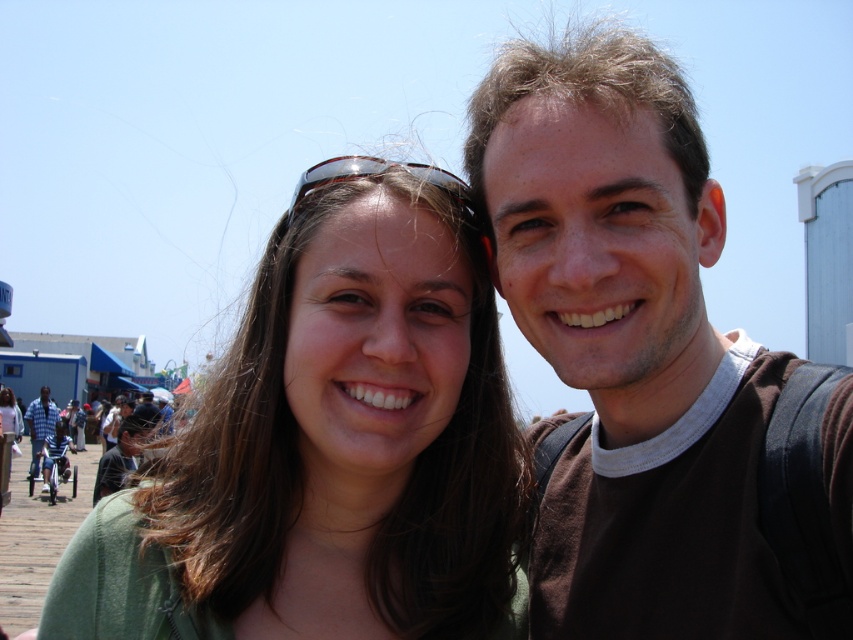
Based on the photo, you are a photographer trying to capture a closeup shot of the sunglasses at center and the green matte hair at center. Which object should you focus on first if you want to ensure both are in focus?

The green matte hair at center is positioned on the right side of sunglasses at center. Since they are both at the same distance from the camera, focusing on either one will keep both in focus.

You are standing at the edge of a boardwalk and see the person with green matte hair at center in the distance. If you want to take a closer photo of them without moving, which direction should you zoom your camera lens?

The green matte hair at center is 14.09 meters away from the viewer. To take a closer photo without moving, you should zoom your camera lens forward to focus on the green matte hair at center.

You are standing in front of the image and want to determine which of the two points, point (231, 612) or point (463, 186), is nearer to you. Based on the scene, which point is closer?

Point (231, 612) is closer to the camera than point (463, 186), so the point (231, 612) is nearer to you.